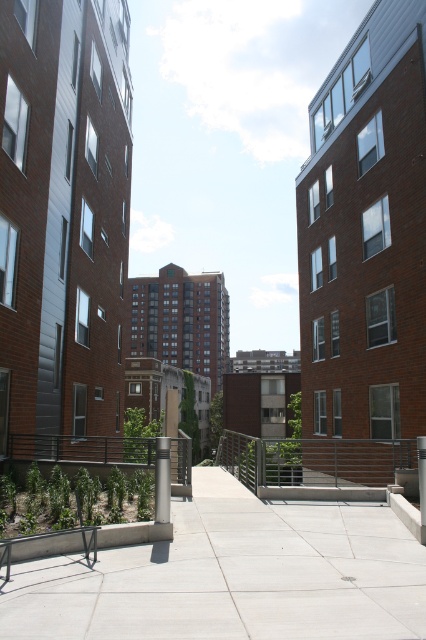
You are a delivery person trying to navigate through the walkway. You see the gray concrete pavement at center and the satin silver post at center. Which object is positioned lower from the ground level?

The gray concrete pavement at center is located below the satin silver post at center, so the gray concrete pavement at center is positioned lower from the ground level.

You are a delivery robot that needs to navigate through the walkway. The gray concrete pavement at center and the metallic silver balustrade at center are in your path. Which one has a larger surface area for you to move around?

The metallic silver balustrade at center has a larger surface area than the gray concrete pavement at center, so you should navigate around it accordingly.

You are standing on the walkway between the two red brick buildings. You notice a specific point marked at coordinates (233, 576). What is located at this point?

The point at coordinates (233, 576) indicates the gray concrete pavement at center.